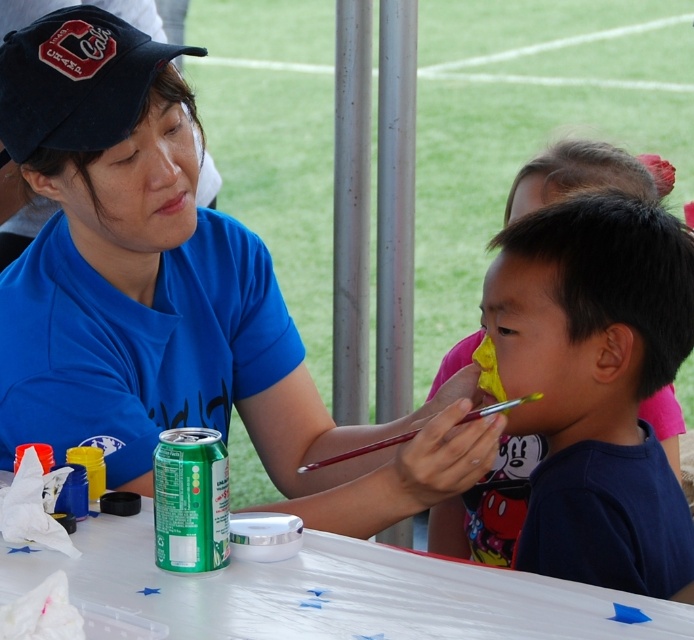
Question: Is dark blue fabric shirt at right further to camera compared to white plastic table at center?

Choices:
 (A) no
 (B) yes

Answer: (B)

Question: Which of these objects is positioned closest to the blue fabric shirt at upper left?

Choices:
 (A) dark blue fabric shirt at right
 (B) black fabric cap at upper left
 (C) green matte can at lower left
 (D) white plastic table at center

Answer: (B)

Question: Estimate the real-world distances between objects in this image. Which object is closer to the black fabric cap at upper left?

Choices:
 (A) white plastic table at center
 (B) green matte can at lower left

Answer: (B)

Question: In this image, where is blue fabric shirt at upper left located relative to dark blue fabric shirt at right?

Choices:
 (A) above
 (B) below

Answer: (A)

Question: Can you confirm if blue fabric shirt at upper left is positioned below dark blue fabric shirt at right?

Choices:
 (A) no
 (B) yes

Answer: (A)

Question: Estimate the real-world distances between objects in this image. Which object is closer to the blue fabric shirt at upper left?

Choices:
 (A) green matte can at lower left
 (B) white plastic table at center
 (C) dark blue fabric shirt at right

Answer: (B)